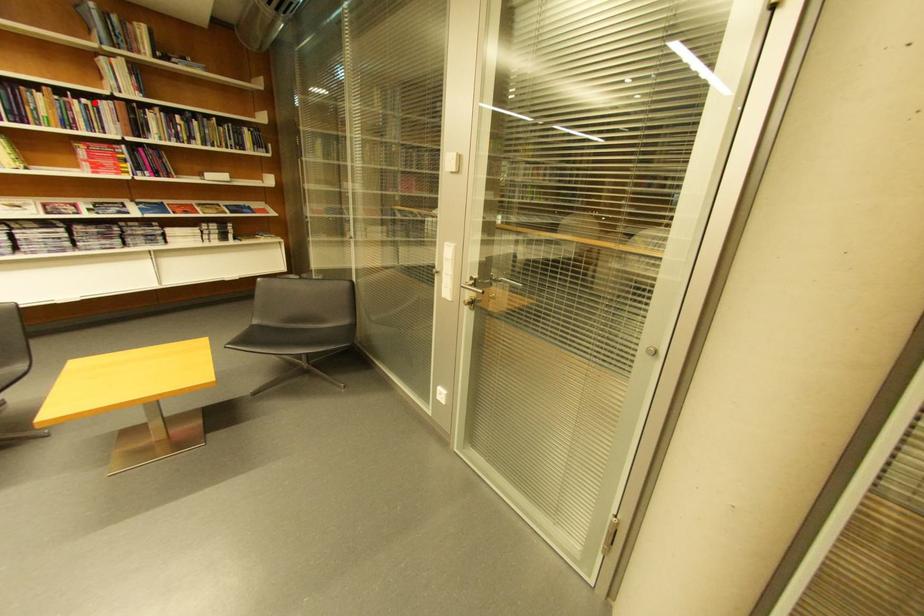
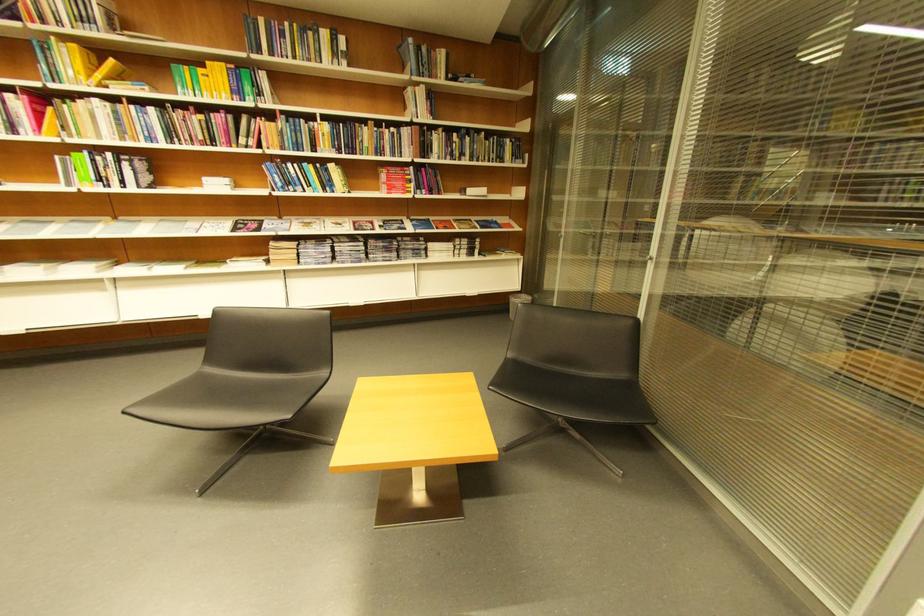
Where in the second image is the point corresponding to the highlighted location from the first image?

(403, 131)